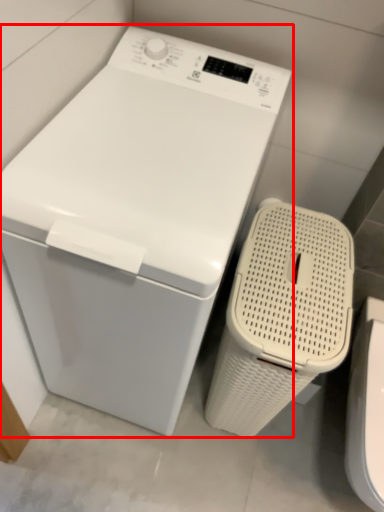
Question: Where is washing machine (annotated by the red box) located in relation to washer in the image?

Choices:
 (A) left
 (B) right

Answer: (A)